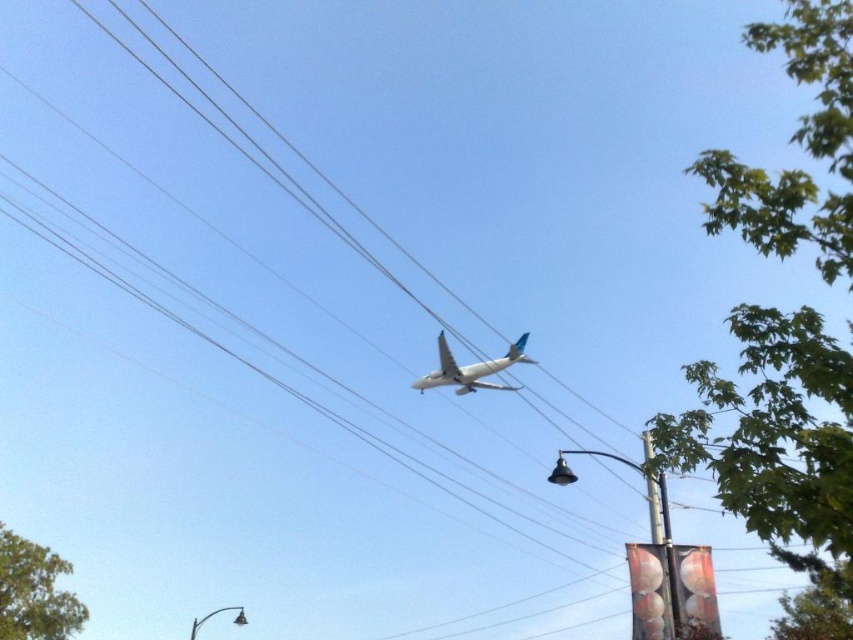
You are a pilot flying the commercial airplane in the scene. You notice two green leafy trees in your view. Which tree, the green leafy tree at upper right or the green leafy tree at lower left, is closer to you?

The green leafy tree at upper right is closer to you because it is in front of the green leafy tree at lower left.

You are standing at the point marked as point (776, 440) in the image. Looking around, you see a commercial airplane flying low overhead and a streetlight with a curved arm to the right of the airplane. What object is located at your current position?

The green leafy tree at upper right is located at point (776, 440).

You are standing at the base of the streetlight with the curved arm and globe lamp. You want to look at the point marked at coordinates (722, 228) in the image. Is this point closer to you or farther away than the airplane?

The point marked at coordinates (722, 228) is 4.45 meters away from you. Since the airplane is flying low overhead, it is likely closer than 4.45 meters, so the point is farther away than the airplane.